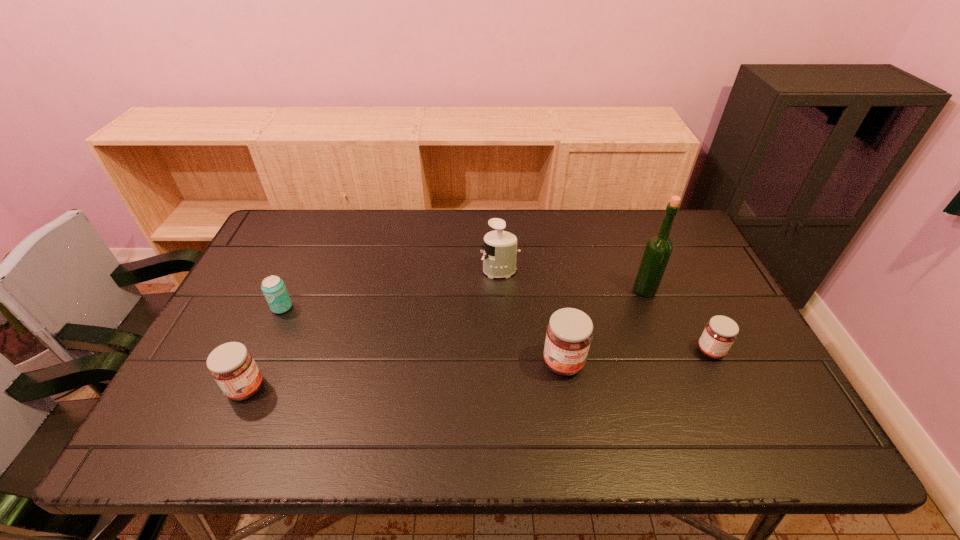
Locate an element on the screen. jam that is the second closest to the tallest jam is located at coordinates (232, 366).

Identify which jam is the closest to the second shortest jam. Please provide its 2D coordinates. Your answer should be formatted as a tuple, i.e. [(x, y)], where the tuple contains the x and y coordinates of a point satisfying the conditions above.

[(569, 334)]